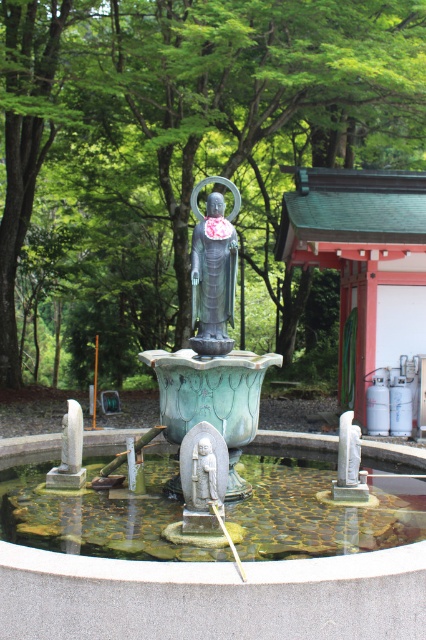
Question: Is green patina stone fountain at center to the left of polished bronze statue at center from the viewer's perspective?

Choices:
 (A) no
 (B) yes

Answer: (B)

Question: Is clear stone water at center thinner than polished bronze statue at center?

Choices:
 (A) no
 (B) yes

Answer: (A)

Question: Based on their relative distances, which object is farther from the clear stone water at center?

Choices:
 (A) polished bronze statue at center
 (B) green leafy tree at upper center

Answer: (B)

Question: Does green patina stone fountain at center have a smaller size compared to polished bronze statue at center?

Choices:
 (A) no
 (B) yes

Answer: (B)

Question: Which point is closer to the camera taking this photo?

Choices:
 (A) (245, 86)
 (B) (290, 556)
 (C) (216, 266)
 (D) (356, 513)

Answer: (B)

Question: Which object is closer to the camera taking this photo?

Choices:
 (A) clear stone water at center
 (B) green patina stone fountain at center
 (C) green leafy tree at upper center
 (D) polished bronze statue at center

Answer: (A)